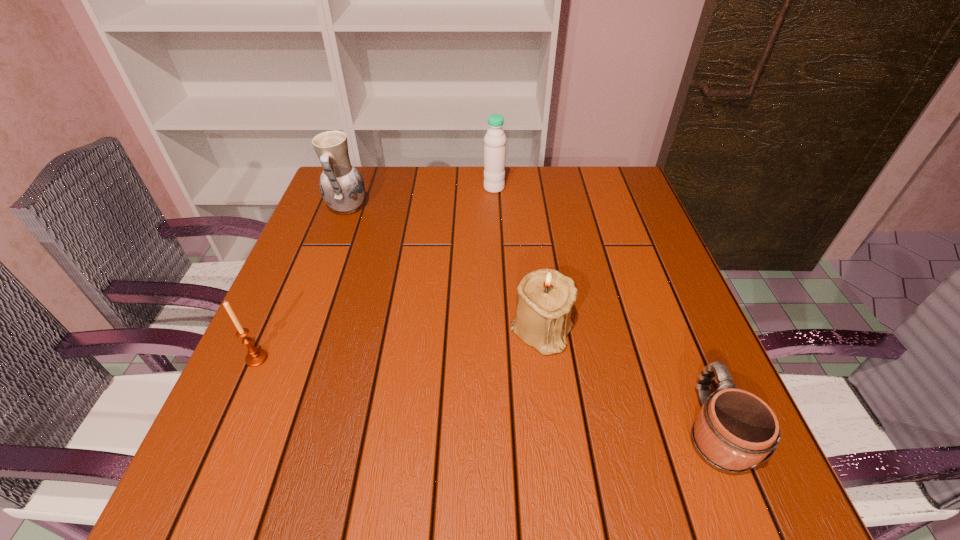
Where is `vacant region that satisfies the following two spatial constraints: 1. on either side of the pottery; 2. on the front side of the left candle_holder`? The image size is (960, 540). vacant region that satisfies the following two spatial constraints: 1. on either side of the pottery; 2. on the front side of the left candle_holder is located at coordinates (292, 358).

Where is `blank space that satisfies the following two spatial constraints: 1. on either side of the pottery; 2. on the side of the shortest object with the handle`? blank space that satisfies the following two spatial constraints: 1. on either side of the pottery; 2. on the side of the shortest object with the handle is located at coordinates (266, 429).

Image resolution: width=960 pixels, height=540 pixels. I want to click on vacant space that satisfies the following two spatial constraints: 1. on either side of the right candle_holder; 2. on the left side of the pottery, so click(x=302, y=330).

I want to click on vacant region that satisfies the following two spatial constraints: 1. on the side of the mug with the handle; 2. on either side of the pottery, so click(625, 208).

Locate an element on the screen. Image resolution: width=960 pixels, height=540 pixels. free space that satisfies the following two spatial constraints: 1. on either side of the pottery; 2. on the side of the mug with the handle is located at coordinates (266, 429).

This screenshot has height=540, width=960. Identify the location of vacant region that satisfies the following two spatial constraints: 1. on either side of the pottery; 2. on the side of the shortest object with the handle. (266, 429).

Identify the location of blank space that satisfies the following two spatial constraints: 1. on either side of the right candle_holder; 2. on the left side of the pottery. The height and width of the screenshot is (540, 960). 302,330.